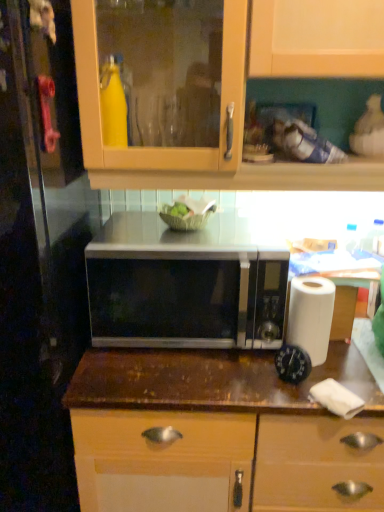
Locate an element on the screen. This screenshot has width=384, height=512. free spot to the right of white paper at right is located at coordinates (351, 369).